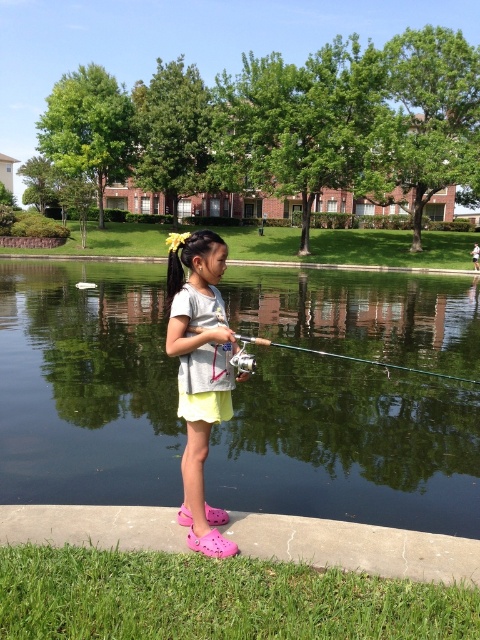
Question: Which point appears farthest from the camera in this image?

Choices:
 (A) (412, 371)
 (B) (276, 360)

Answer: (B)

Question: Which of the following is the closest to the observer?

Choices:
 (A) (375, 362)
 (B) (319, 506)
 (C) (216, 358)

Answer: (C)

Question: Is light gray cotton shirt at center wider than metallic silver fishing pole at center?

Choices:
 (A) yes
 (B) no

Answer: (B)

Question: Which point is closer to the camera taking this photo?

Choices:
 (A) (465, 298)
 (B) (188, 260)
 (C) (419, 369)

Answer: (B)

Question: Is green reflective water at center smaller than light gray cotton shirt at center?

Choices:
 (A) yes
 (B) no

Answer: (B)

Question: Is green reflective water at center bigger than metallic silver fishing pole at center?

Choices:
 (A) no
 (B) yes

Answer: (B)